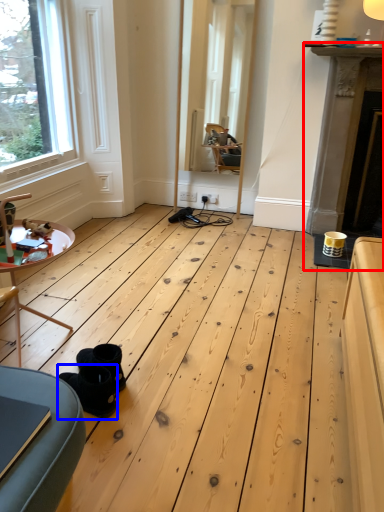
Question: Among these objects, which one is nearest to the camera, fireplace (highlighted by a red box) or footwear (highlighted by a blue box)?

Choices:
 (A) fireplace
 (B) footwear

Answer: (B)